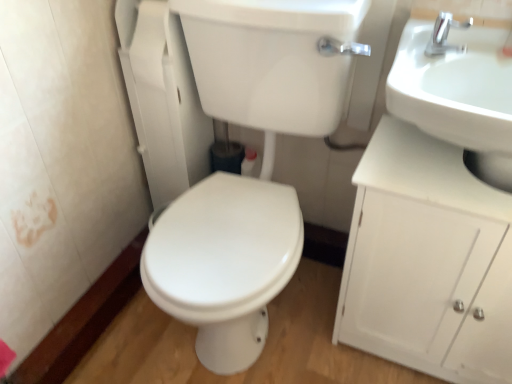
Locate an element on the screen. This screenshot has width=512, height=384. empty space that is ontop of white matte cabinet at right (from a real-world perspective) is located at coordinates (437, 164).